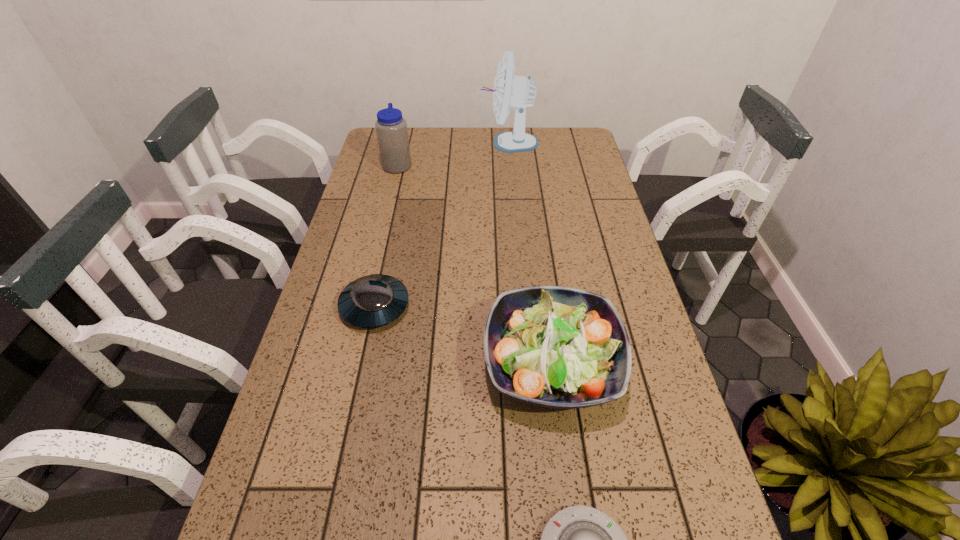
In the image, there is a desktop. Identify the location of vacant space at the far right corner. (577, 150).

Where is `unoccupied position between the second shortest object and the salad plate`? This screenshot has width=960, height=540. unoccupied position between the second shortest object and the salad plate is located at coordinates (463, 335).

Where is `unoccupied position between the water bottle and the fan`? unoccupied position between the water bottle and the fan is located at coordinates (453, 154).

Find the location of a particular element. free space that is in between the fan and the fourth tallest object is located at coordinates (442, 225).

Image resolution: width=960 pixels, height=540 pixels. I want to click on vacant space that is in between the fan and the fourth tallest object, so click(x=442, y=225).

I want to click on vacant area between the fan and the fourth tallest object, so click(442, 225).

I want to click on free space between the fourth shortest object and the tallest object, so click(x=453, y=154).

Find the location of a particular element. vacant space that's between the water bottle and the farther saucer is located at coordinates coord(386,235).

The image size is (960, 540). I want to click on blank region between the taller saucer and the water bottle, so click(386, 235).

I want to click on empty space between the water bottle and the third tallest object, so click(x=474, y=264).